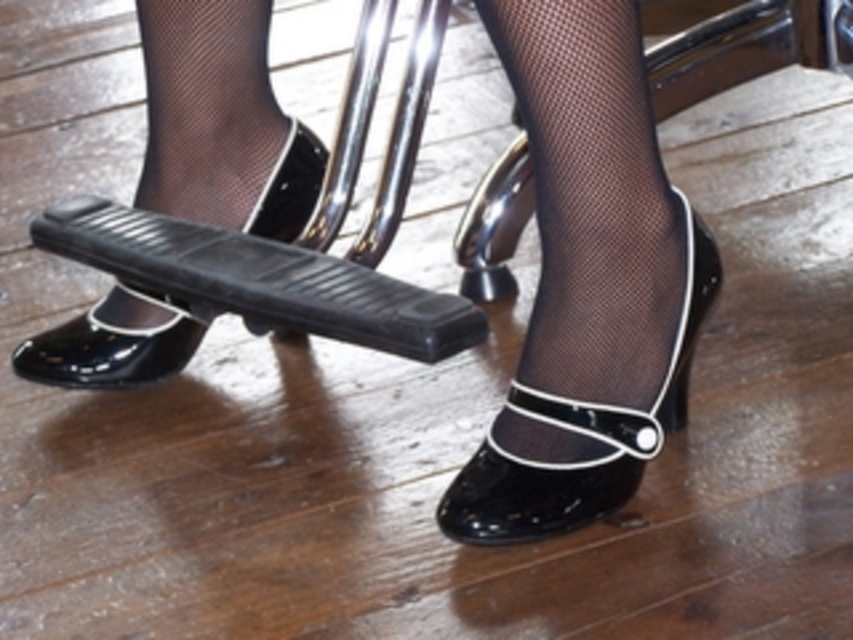
You are a photographer setting up a shoot. You need to place a small prop between the black patent leather shoe at center and the glossy patent leather shoe at lower left. Based on their positions, where should you place the prop to ensure it is visible in the frame?

The black patent leather shoe at center is in front of the glossy patent leather shoe at lower left, so place the prop between them but closer to the glossy patent leather shoe at lower left to ensure it stays visible behind the front shoe.

You are a photographer setting up a shoot for a fashion magazine. You need to ensure that the black patent leather shoe at center and the glossy patent leather shoe at lower left are both visible in the frame. Given their sizes, which shoe should you position closer to the camera to maintain their apparent sizes as per the original design?

The black patent leather shoe at center is smaller than the glossy patent leather shoe at lower left. To maintain their apparent sizes as per the original design, you should position the smaller black patent leather shoe at center closer to the camera so it appears larger, balancing its size with the glossy patent leather shoe at lower left.